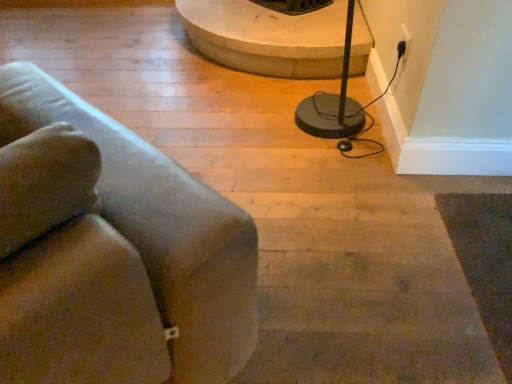
The height and width of the screenshot is (384, 512). Describe the element at coordinates (404, 42) in the screenshot. I see `black plastic outlet at upper right` at that location.

Where is `black plastic outlet at upper right`? black plastic outlet at upper right is located at coordinates (404, 42).

The image size is (512, 384). In order to click on black plastic outlet at upper right in this screenshot , I will do `click(404, 42)`.